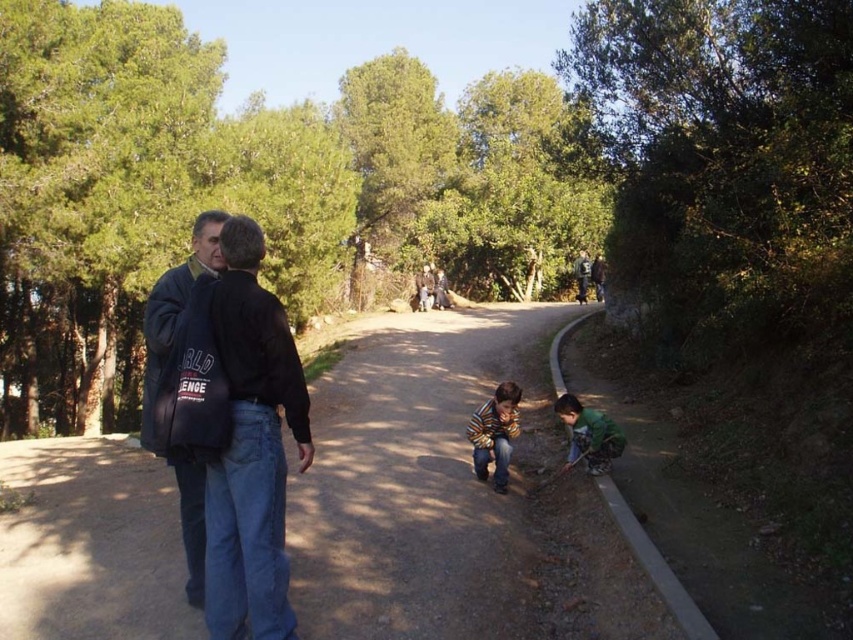
You are a photographer positioned on the dirt path and want to capture both the black cotton jacket at left and the dark blue jacket at left in a single photo. Considering their heights, which jacket will appear taller in the photo?

The black cotton jacket at left will appear taller in the photo because it has a greater height compared to the dark blue jacket at left.

You are a photographer positioned on the dirt path and want to take a photo of both the black cotton jacket at left and the dark blue jacket at left. Since you can only focus on one person at a time, which jacket should you focus on to ensure the other is still in the frame?

You should focus on the black cotton jacket at left because it is closer to the viewer than the dark blue jacket at left, so keeping it in focus will naturally include the dark blue jacket at left in the background of the photo.